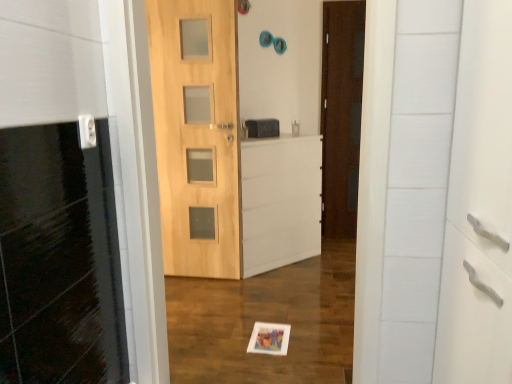
I want to click on free point below natural wood door at center, marked as the 2th door in a right-to-left arrangement (from a real-world perspective), so click(202, 279).